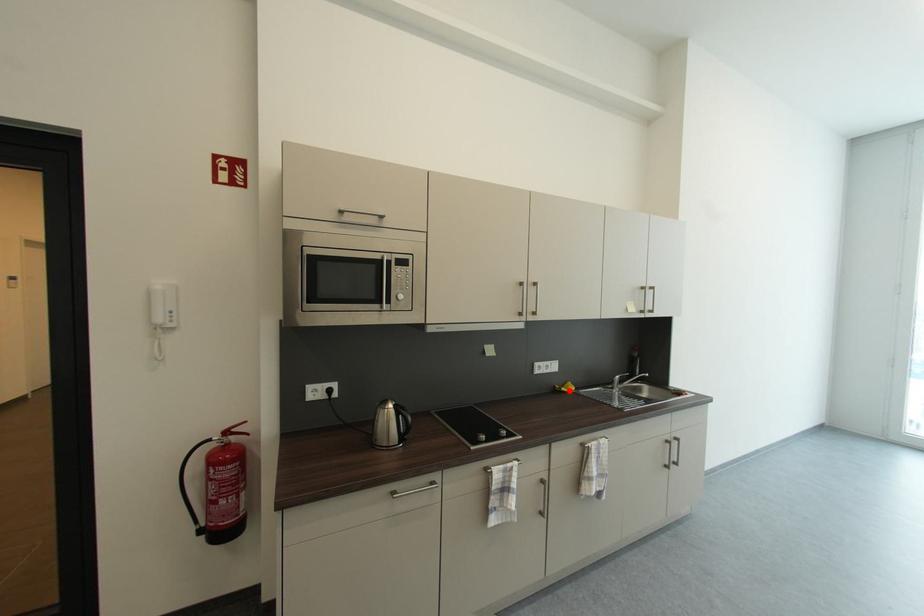
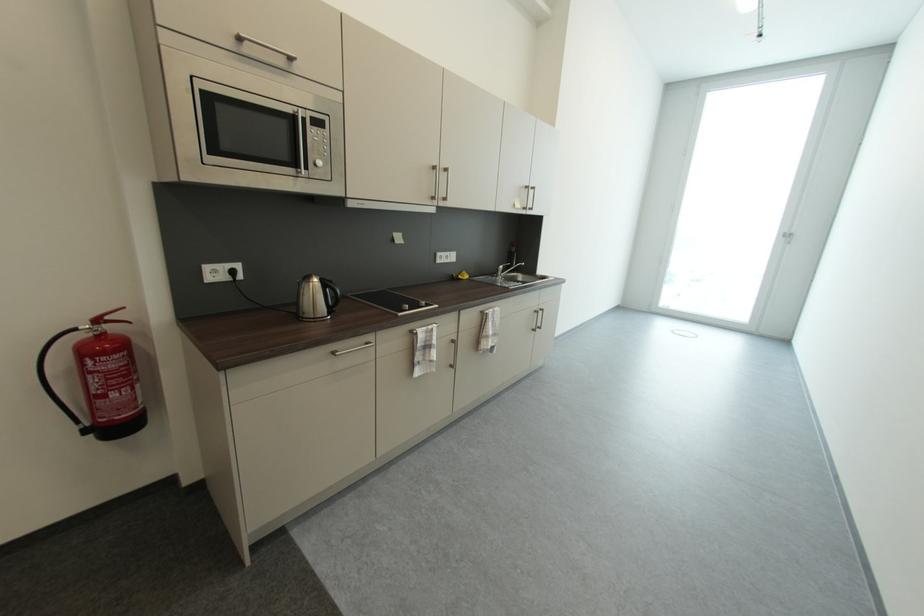
Question: I am providing you with two images of the same scene from different viewpoints. In image1, a red point is highlighted. Considering the same 3D point in image2, which of the following is correct?

Choices:
 (A) It is closer
 (B) It is farther

Answer: (A)